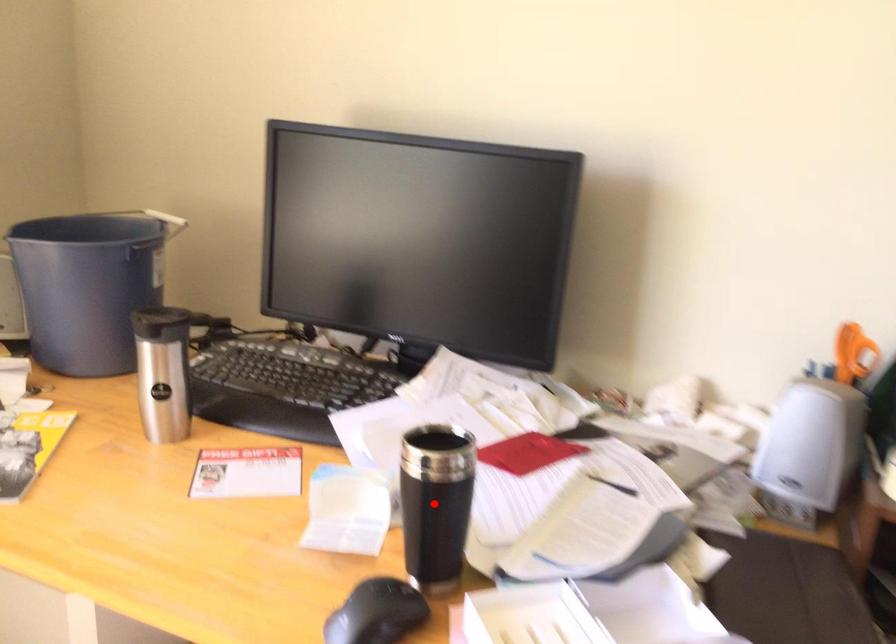
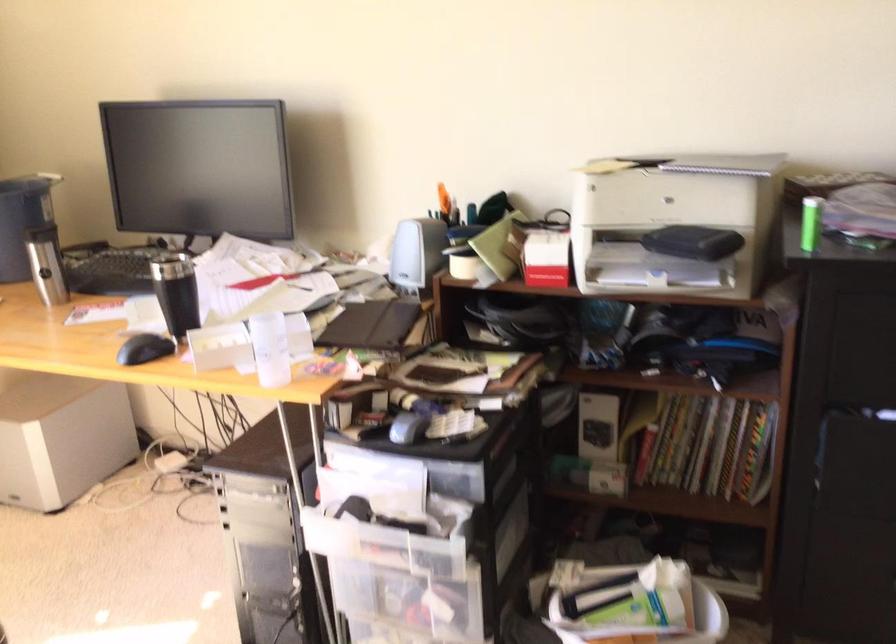
Question: I am providing you with two images of the same scene from different viewpoints. Image1 has a red point marked. In image2, the corresponding 3D location appears at what relative position? Reply with the corresponding letter.

Choices:
 (A) Closer
 (B) Farther

Answer: (B)